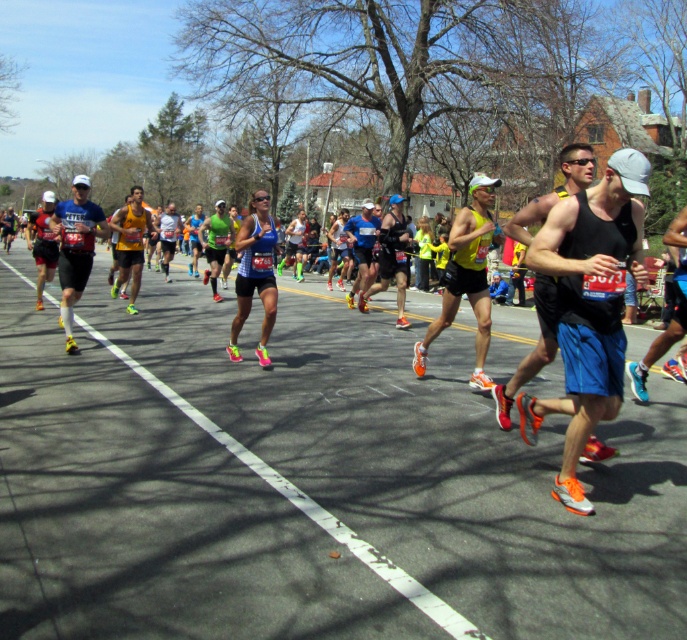
Question: Does matte black tank top at center appear over black tank top at center?

Choices:
 (A) no
 (B) yes

Answer: (A)

Question: Which object is the farthest from the matte blue tank top at center?

Choices:
 (A) matte black shorts at left
 (B) matte black tank top at center

Answer: (B)

Question: Among these points, which one is nearest to the camera?

Choices:
 (A) (69, 216)
 (B) (539, 307)
 (C) (368, 248)

Answer: (B)

Question: Does matte black tank top at center appear on the right side of matte blue tank top at center?

Choices:
 (A) yes
 (B) no

Answer: (A)

Question: Does matte black tank top at center have a larger size compared to matte black shorts at left?

Choices:
 (A) no
 (B) yes

Answer: (A)

Question: Based on their relative distances, which object is farther from the matte black tank top at center?

Choices:
 (A) black tank top at center
 (B) matte black shorts at left
 (C) matte blue tank top at center

Answer: (C)